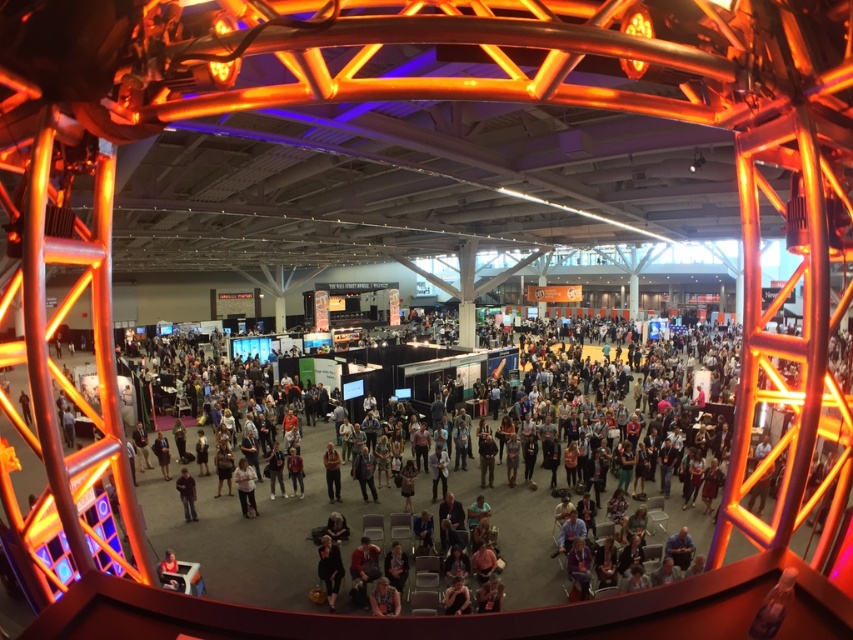
Can you confirm if light brown fabric shirt at center is wider than dark gray shirt at lower center?

In fact, light brown fabric shirt at center might be narrower than dark gray shirt at lower center.

Between point (252, 486) and point (190, 500), which one is positioned behind?

The point (190, 500) is behind.

The image size is (853, 640). What are the coordinates of `light brown fabric shirt at center` in the screenshot? It's located at (245, 486).

Who is lower down, light brown leather jacket at center or dark gray shirt at lower center?

dark gray shirt at lower center

Is light brown leather jacket at center to the left of dark gray shirt at lower center from the viewer's perspective?

No, light brown leather jacket at center is not to the left of dark gray shirt at lower center.

Who is more forward, [335,458] or [190,488]?

Point [190,488] is more forward.

The image size is (853, 640). I want to click on light brown leather jacket at center, so click(332, 472).

Who is lower down, black fabric jacket at lower center or dark gray shirt at lower center?

black fabric jacket at lower center

Based on the photo, between black fabric jacket at lower center and dark gray shirt at lower center, which one has less height?

black fabric jacket at lower center

What do you see at coordinates (329, 570) in the screenshot? The image size is (853, 640). I see `black fabric jacket at lower center` at bounding box center [329, 570].

Image resolution: width=853 pixels, height=640 pixels. What are the coordinates of `black fabric jacket at lower center` in the screenshot? It's located at (329, 570).